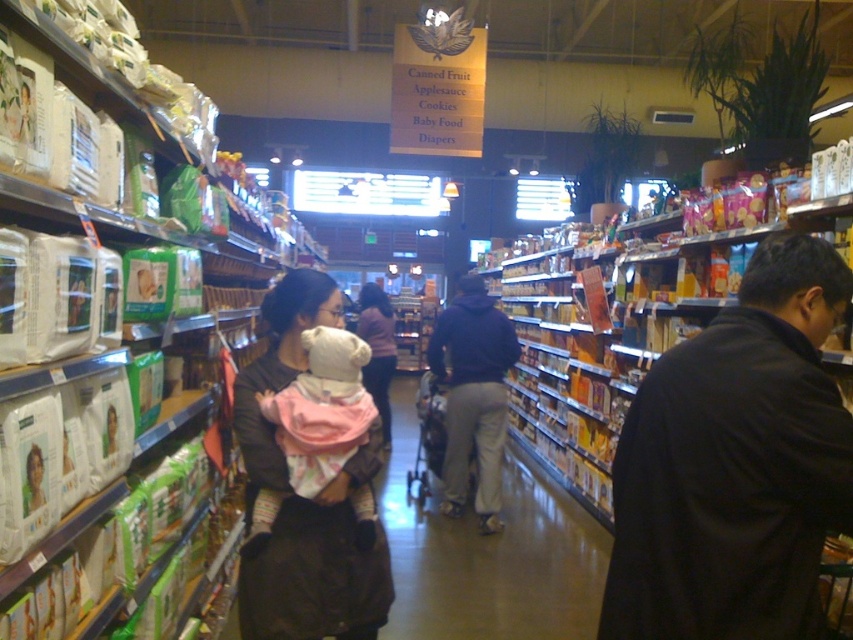
You are a delivery robot in the grocery store and need to navigate to a specific point marked as point [773,557]. The robot is 1.2 meters tall. Can the robot see the point from its current position?

The point [773,557] is 1.44 meters from the camera. Since the robot is 1.2 meters tall, it can see the point as it is within its line of sight.

You are a customer in the grocery store aisle. You see a pink fabric baby at center and a dark blue hoodie at center. Which item is located higher on the shelf?

The pink fabric baby at center is positioned over the dark blue hoodie at center, so it is located higher on the shelf.